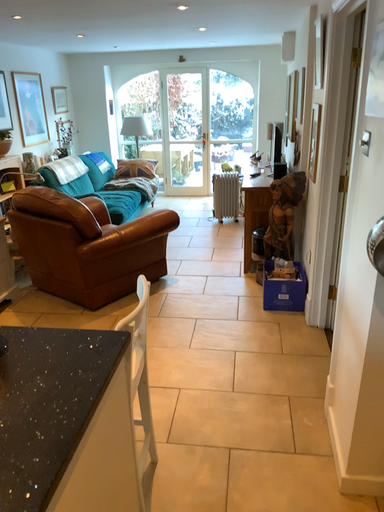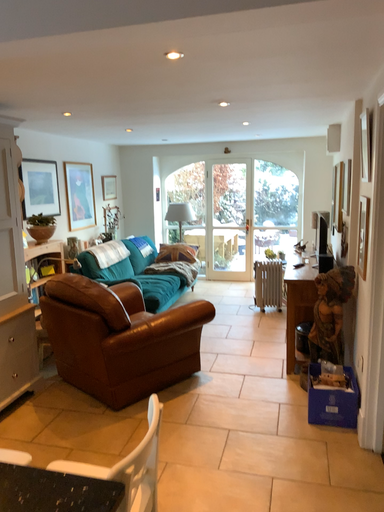
Question: How did the camera likely rotate when shooting the video?

Choices:
 (A) rotated downward
 (B) rotated upward

Answer: (B)